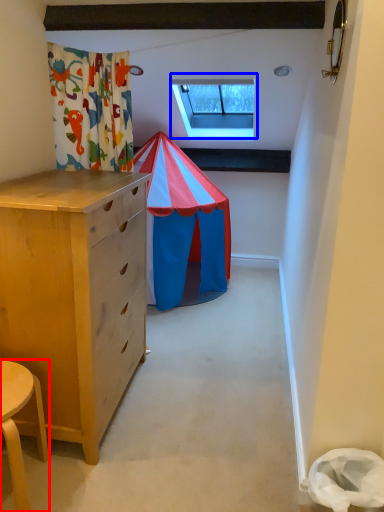
Question: Which object is further to the camera taking this photo, table (highlighted by a red box) or window (highlighted by a blue box)?

Choices:
 (A) table
 (B) window

Answer: (B)